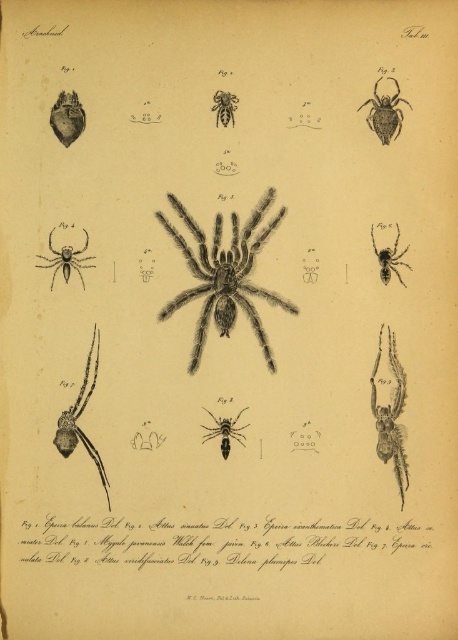
Between matte black spider at upper left and shiny black spider at center, which one is positioned lower?

matte black spider at upper left is lower down.

Who is positioned more to the left, matte black spider at upper left or shiny black spider at center?

matte black spider at upper left is more to the left.

Measure the distance between point (72, 256) and camera.

They are 1.47 meters apart.

This screenshot has height=640, width=458. In order to click on matte black spider at upper left in this screenshot , I will do click(65, 259).

Is point (374, 124) less distant than point (244, 428)?

No, it is not.

Between matte black spider at upper right and black fuzzy spider at center, which one is positioned higher?

matte black spider at upper right is higher up.

The width and height of the screenshot is (458, 640). Identify the location of matte black spider at upper right. (385, 113).

Identify the location of matte black spider at upper right. The image size is (458, 640). (385, 113).

Between shiny metallic spider at lower left and matte black spider at upper right, which one has more height?

shiny metallic spider at lower left

Is point (86, 403) farther from camera compared to point (365, 102)?

No.

Who is more distant from viewer, (58, 445) or (386, 113)?

Point (386, 113)

In order to click on shiny metallic spider at lower left in this screenshot , I will do `click(80, 416)`.